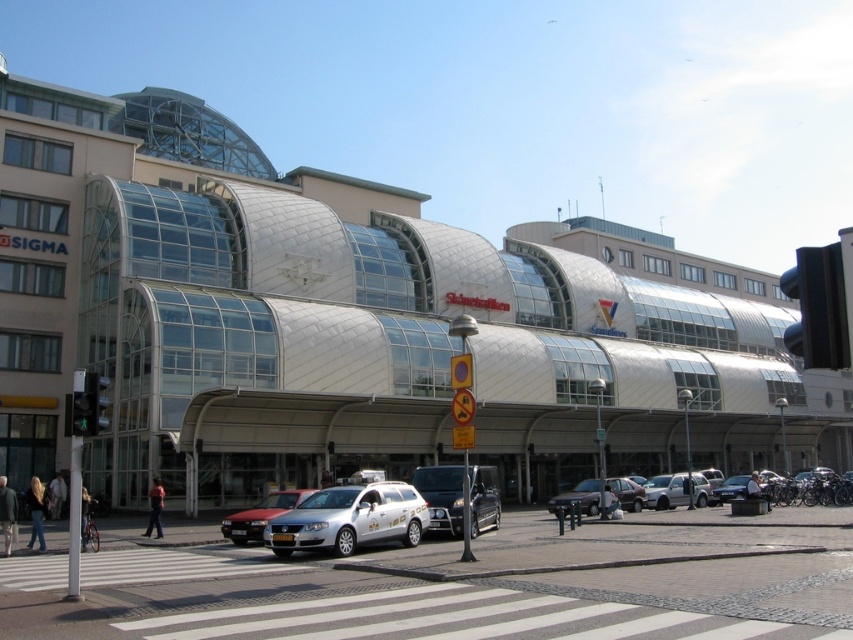
Question: Among these objects, which one is nearest to the camera?

Choices:
 (A) green glass traffic light at center
 (B) matte red car at lower center

Answer: (A)

Question: Is silver metallic station wagon at center smaller than dark gray metallic van at center?

Choices:
 (A) no
 (B) yes

Answer: (B)

Question: Is matte red car at lower center positioned behind green matte pedestrian signal at lower left?

Choices:
 (A) no
 (B) yes

Answer: (B)

Question: Among these points, which one is nearest to the camera?

Choices:
 (A) (65, 397)
 (B) (712, 497)
 (C) (596, 484)
 (D) (670, 502)

Answer: (C)

Question: In this image, where is white glass building at center located relative to silver metallic sedan at center?

Choices:
 (A) right
 (B) left

Answer: (B)

Question: Which object appears closest to the camera in this image?

Choices:
 (A) green glass traffic light at center
 (B) white glass building at center

Answer: (A)